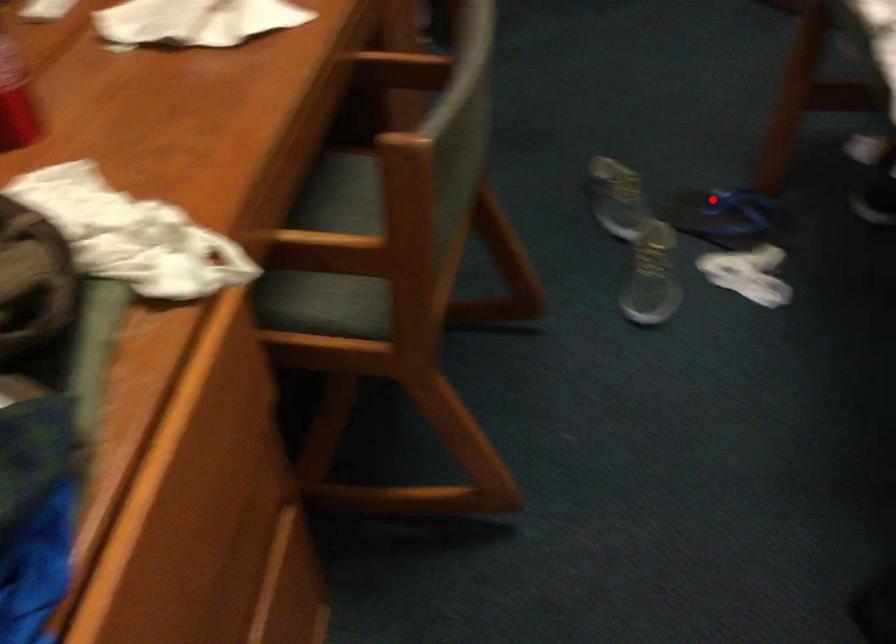
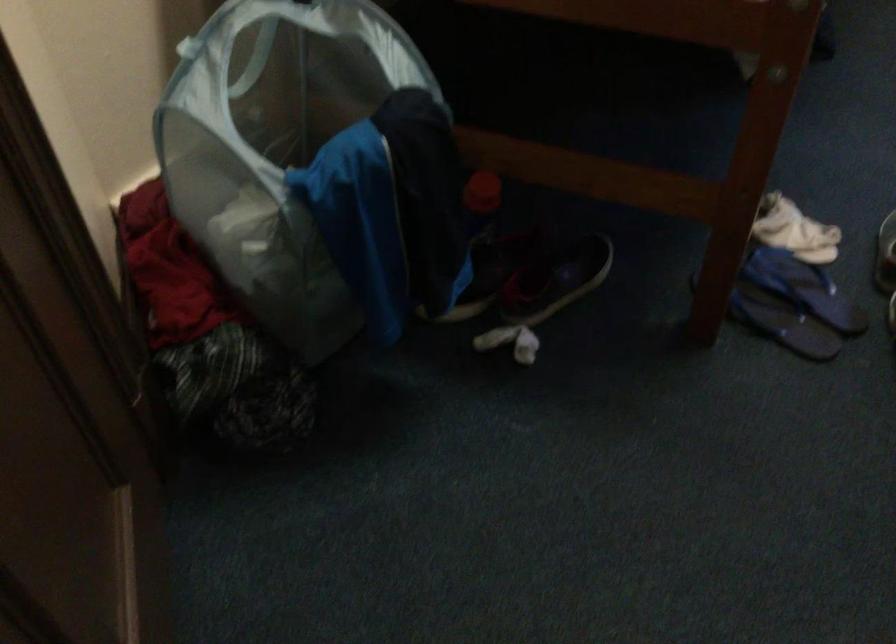
Find the pixel in the second image that matches the highlighted location in the first image.

(782, 323)